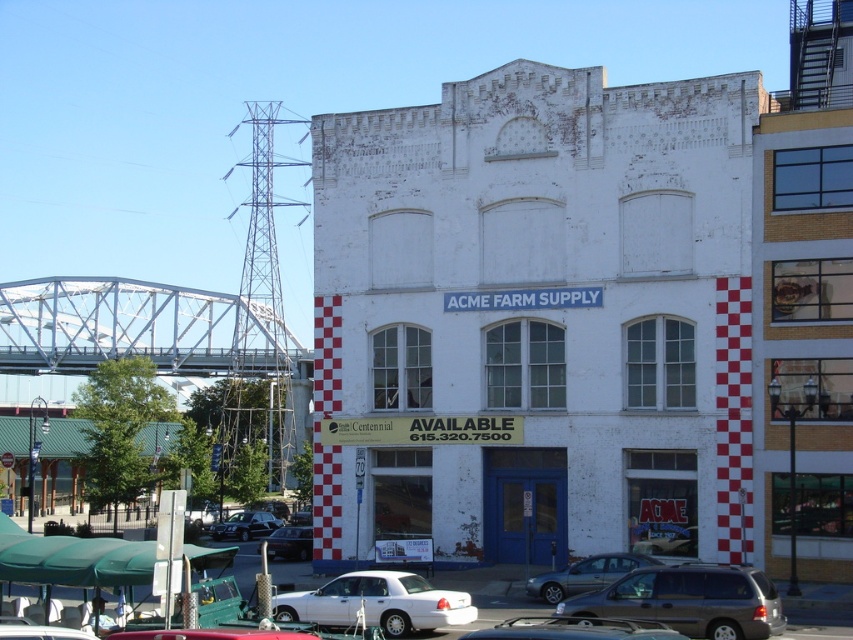
You are a delivery driver who needs to park your truck next to the building. You see a silver metallic sedan at lower center and a matte black car at lower left. Which vehicle should you avoid parking too close to if you want to leave first?

The silver metallic sedan at lower center has a smaller size compared to matte black car at lower left, so you should avoid parking too close to the matte black car at lower left since it is larger and might block your path when leaving.

You are a delivery driver needing to park your truck, which is 2.5 meters wide, next to the shiny black sedan at lower left and the matte black car at lower left. Can you fit your truck between them without touching either?

The shiny black sedan at lower left might be wider than the matte black car at lower left, but without exact measurements, it is uncertain if there is enough space for a 2.5 meter wide truck. Check the actual width of both vehicles before deciding.

You are a delivery driver who needs to park your truck, which is 2 meters wide, between the silver metallic sedan at lower center and the matte black car at lower left. Can you fit your truck between them?

The silver metallic sedan at lower center is wider than the matte black car at lower left. However, the combined width of both vehicles is not provided, so it is impossible to determine if there is enough space for the truck.